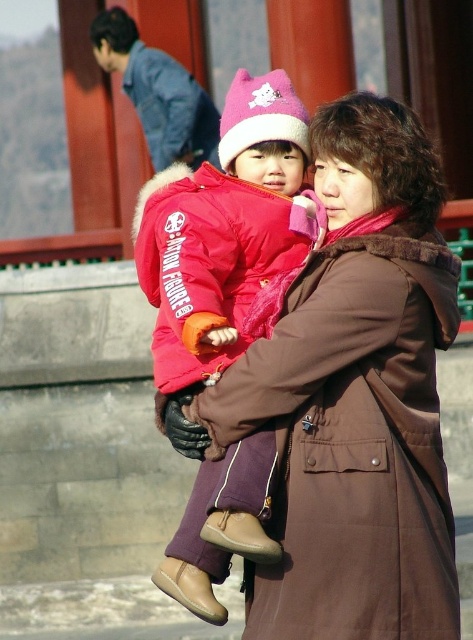
You are a photographer trying to capture both the matte red jacket at center and the matte pink jacket at center in a single shot. Based on their positions, which jacket should you focus on first to ensure both are in frame?

The matte red jacket at center is located below the matte pink jacket at center, so you should focus on the matte pink jacket at center first to ensure both are in frame.